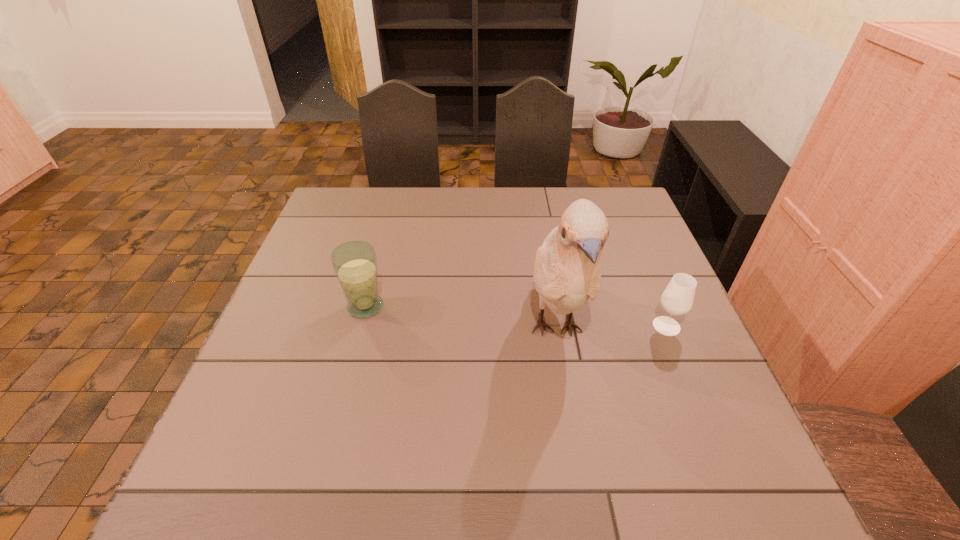
The height and width of the screenshot is (540, 960). I want to click on vacant space at the near edge, so click(354, 504).

Image resolution: width=960 pixels, height=540 pixels. Identify the location of vacant area at the left edge. (220, 448).

Locate an element on the screen. vacant area at the right edge of the desktop is located at coordinates (624, 276).

Identify the location of free location at the far left corner. (365, 220).

In order to click on free space at the near left corner in this screenshot , I will do `click(242, 467)`.

Identify the location of free space at the far right corner of the desktop. The image size is (960, 540). (619, 194).

This screenshot has height=540, width=960. I want to click on vacant space that is in between the leftmost object and the tallest object, so click(461, 318).

The width and height of the screenshot is (960, 540). What are the coordinates of `free space between the left glass and the rightmost object` in the screenshot? It's located at (516, 316).

Identify the location of free space that is in between the left glass and the rightmost object. (516, 316).

You are a GUI agent. You are given a task and a screenshot of the screen. Output one action in this format:
    pyautogui.click(x=<x>, y=<y>)
    Task: Click on the vacant region between the rightmost object and the tallest object
    This screenshot has height=540, width=960.
    Given the screenshot: What is the action you would take?
    pyautogui.click(x=611, y=327)